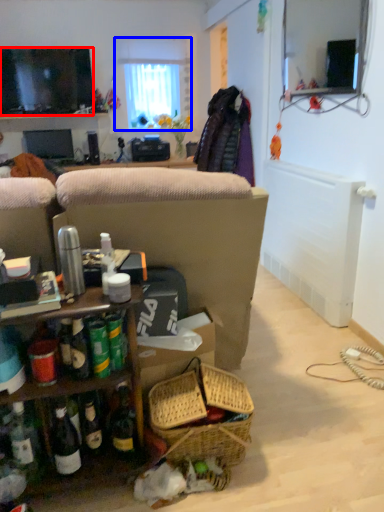
Question: Which object appears farthest to the camera in this image, television (highlighted by a red box) or window (highlighted by a blue box)?

Choices:
 (A) television
 (B) window

Answer: (B)